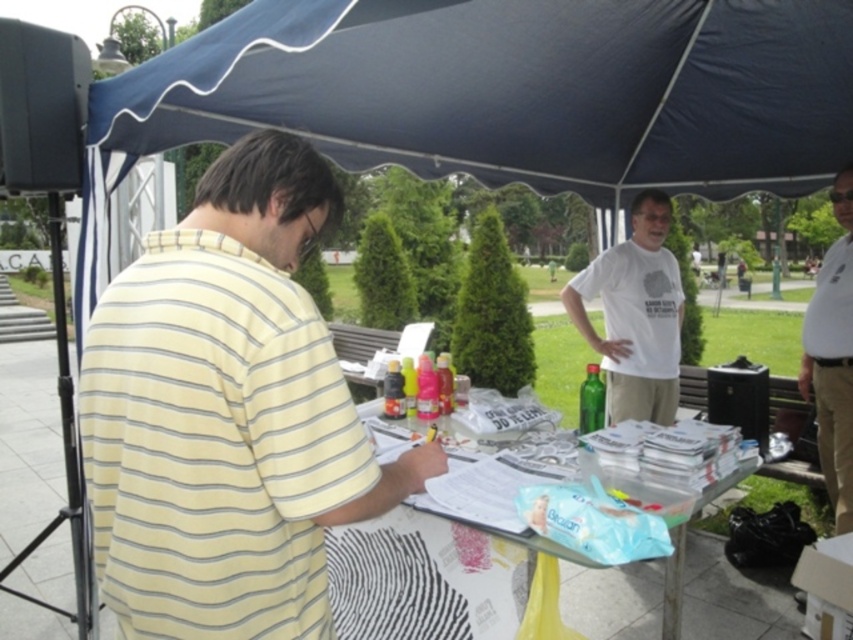
Question: Which point appears closest to the camera in this image?

Choices:
 (A) (315, 346)
 (B) (407, 612)

Answer: (A)

Question: Observing the image, what is the correct spatial positioning of dark blue fabric canopy at upper center in reference to yellow striped shirt at left?

Choices:
 (A) left
 (B) right

Answer: (B)

Question: Does yellow striped shirt at left appear under white cotton shirt at upper center?

Choices:
 (A) yes
 (B) no

Answer: (B)

Question: Which object appears closest to the camera in this image?

Choices:
 (A) yellow striped shirt at left
 (B) white cotton polo shirt at right
 (C) white plastic table at center

Answer: (A)

Question: Which point is closer to the camera?

Choices:
 (A) dark blue fabric canopy at upper center
 (B) white plastic table at center
 (C) yellow striped shirt at left

Answer: (C)

Question: Can you confirm if dark blue fabric canopy at upper center is positioned to the right of yellow striped shirt at left?

Choices:
 (A) yes
 (B) no

Answer: (A)